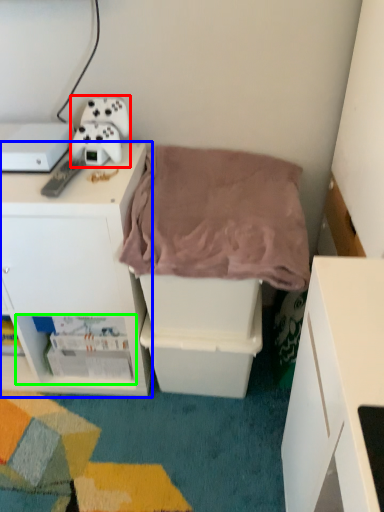
Question: Which is nearer to the equipment (highlighted by a red box)? cabinetry (highlighted by a blue box) or shelf (highlighted by a green box).

Choices:
 (A) cabinetry
 (B) shelf

Answer: (A)